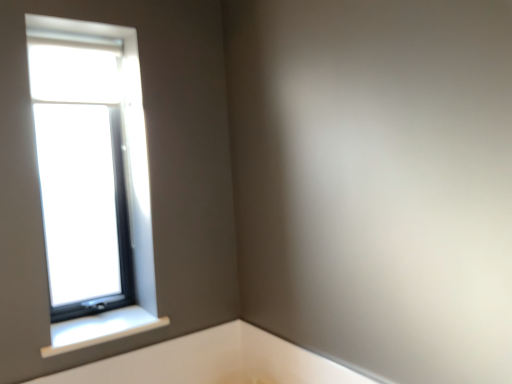
Locate an element on the screen. The height and width of the screenshot is (384, 512). white plastic window sill at lower left is located at coordinates (100, 329).

This screenshot has height=384, width=512. What do you see at coordinates (100, 329) in the screenshot? I see `white plastic window sill at lower left` at bounding box center [100, 329].

In order to face clear glass window at upper left, should I rotate leftwards or rightwards?

A 21.548 degree turn to the left will do.

In order to click on clear glass window at upper left in this screenshot , I will do `click(92, 179)`.

Describe the element at coordinates (92, 179) in the screenshot. I see `clear glass window at upper left` at that location.

Locate an element on the screen. This screenshot has height=384, width=512. white plastic window sill at lower left is located at coordinates coord(100,329).

Consider the image. Is white plastic window sill at lower left to the right of clear glass window at upper left from the viewer's perspective?

Indeed, white plastic window sill at lower left is positioned on the right side of clear glass window at upper left.

Is white plastic window sill at lower left closer to the viewer compared to clear glass window at upper left?

Yes, white plastic window sill at lower left is closer to the viewer.

Does point (130, 334) lie behind point (78, 50)?

No.

From the image's perspective, which one is positioned higher, white plastic window sill at lower left or clear glass window at upper left?

From the image's view, clear glass window at upper left is above.

From a real-world perspective, which is physically below, white plastic window sill at lower left or clear glass window at upper left?

In real-world perspective, white plastic window sill at lower left is lower.

Can you confirm if white plastic window sill at lower left is thinner than clear glass window at upper left?

No.

Considering the sizes of objects white plastic window sill at lower left and clear glass window at upper left in the image provided, who is shorter, white plastic window sill at lower left or clear glass window at upper left?

Standing shorter between the two is white plastic window sill at lower left.

Does white plastic window sill at lower left have a smaller size compared to clear glass window at upper left?

Indeed, white plastic window sill at lower left has a smaller size compared to clear glass window at upper left.

Is white plastic window sill at lower left not within clear glass window at upper left?

Yes, white plastic window sill at lower left is not within clear glass window at upper left.

Are white plastic window sill at lower left and clear glass window at upper left making contact?

No.

Is white plastic window sill at lower left facing away from clear glass window at upper left?

No, white plastic window sill at lower left is not facing the opposite direction of clear glass window at upper left.

How many degrees apart are the facing directions of white plastic window sill at lower left and clear glass window at upper left?

The facing directions of white plastic window sill at lower left and clear glass window at upper left are 0.457 degrees apart.

Locate an element on the screen. The image size is (512, 384). window behind the white plastic window sill at lower left is located at coordinates (92, 179).

Considering the relative positions of clear glass window at upper left and white plastic window sill at lower left in the image provided, is clear glass window at upper left to the right of white plastic window sill at lower left from the viewer's perspective?

No.

Is clear glass window at upper left closer to the viewer compared to white plastic window sill at lower left?

No, it is not.

Which is closer to the camera, (118, 28) or (122, 329)?

Point (118, 28) is positioned closer to the camera compared to point (122, 329).

From the image's perspective, relative to white plastic window sill at lower left, is clear glass window at upper left above or below?

From the image's perspective, clear glass window at upper left appears above white plastic window sill at lower left.

From a real-world perspective, is clear glass window at upper left beneath white plastic window sill at lower left?

No, from a real-world perspective, clear glass window at upper left is not under white plastic window sill at lower left.

Considering the sizes of objects clear glass window at upper left and white plastic window sill at lower left in the image provided, who is wider, clear glass window at upper left or white plastic window sill at lower left?

Wider between the two is white plastic window sill at lower left.

Is clear glass window at upper left taller or shorter than white plastic window sill at lower left?

In the image, clear glass window at upper left appears to be taller than white plastic window sill at lower left.

Between clear glass window at upper left and white plastic window sill at lower left, which one has larger size?

With larger size is clear glass window at upper left.

Is clear glass window at upper left spatially inside white plastic window sill at lower left, or outside of it?

clear glass window at upper left is not enclosed by white plastic window sill at lower left.

Is there a large distance between clear glass window at upper left and white plastic window sill at lower left?

That's not correct — clear glass window at upper left is a little close to white plastic window sill at lower left.

Is clear glass window at upper left oriented away from white plastic window sill at lower left?

No, clear glass window at upper left is not facing away from white plastic window sill at lower left.

How many degrees apart are the facing directions of clear glass window at upper left and white plastic window sill at lower left?

clear glass window at upper left and white plastic window sill at lower left are facing 0.457 degrees away from each other.

Locate an element on the screen. window sill lying in front of the clear glass window at upper left is located at coordinates (100, 329).

This screenshot has width=512, height=384. In order to click on window sill below the clear glass window at upper left (from the image's perspective) in this screenshot , I will do `click(100, 329)`.

Identify the location of window lying above the white plastic window sill at lower left (from the image's perspective). (92, 179).